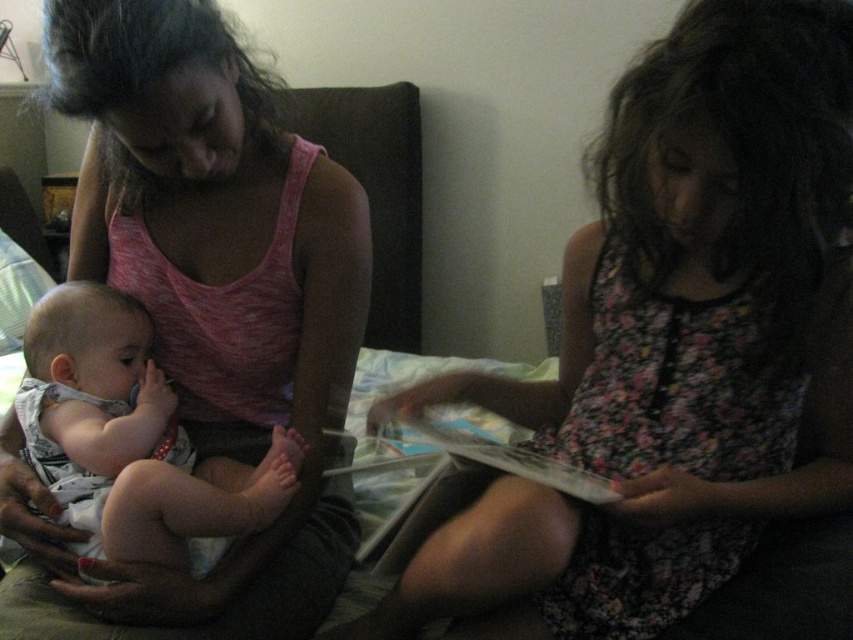
Who is taller, floral dress at center or pink heather tank top at upper left?

With more height is pink heather tank top at upper left.

Is point (612, 90) farther from camera compared to point (283, 228)?

No, it is not.

This screenshot has width=853, height=640. In order to click on floral dress at center in this screenshot , I will do `click(672, 344)`.

Can you confirm if pink heather tank top at upper left is bigger than white cotton onesie at left?

Indeed, pink heather tank top at upper left has a larger size compared to white cotton onesie at left.

Is point (317, 544) less distant than point (283, 442)?

No, (317, 544) is further to viewer.

The image size is (853, 640). In order to click on pink heather tank top at upper left in this screenshot , I will do `click(202, 314)`.

The width and height of the screenshot is (853, 640). Identify the location of pink heather tank top at upper left. (202, 314).

Which is above, floral dress at center or white cotton onesie at left?

floral dress at center is above.

Does floral dress at center lie in front of white cotton onesie at left?

Yes.

Does point (480, 580) come in front of point (152, 374)?

That is True.

The width and height of the screenshot is (853, 640). Find the location of `floral dress at center`. floral dress at center is located at coordinates (672, 344).